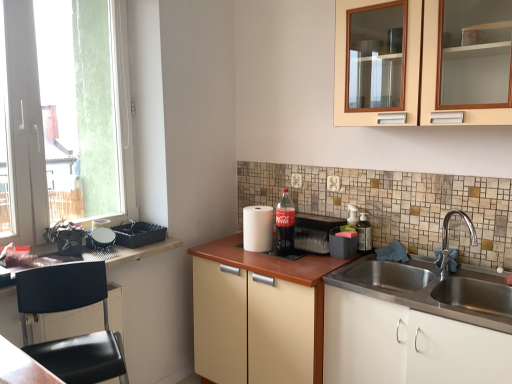
Question: Can you confirm if black plastic chair at lower left, which is the 2th cabinetry from top to bottom, is smaller than matte black tissue box at center, the fourth appliance in the left-to-right sequence?

Choices:
 (A) no
 (B) yes

Answer: (A)

Question: Would you say black plastic chair at lower left, which is the 2th cabinetry from top to bottom, is outside matte black tissue box at center, which is counted as the 1th appliance, starting from the right?

Choices:
 (A) no
 (B) yes

Answer: (B)

Question: Is black plastic chair at lower left, the third cabinetry in the bottom-to-top sequence, directly adjacent to matte black tissue box at center, which is counted as the 1th appliance, starting from the right?

Choices:
 (A) yes
 (B) no

Answer: (B)

Question: Can you confirm if black plastic chair at lower left, which is the 2th cabinetry from top to bottom, is taller than matte black tissue box at center, the fourth appliance in the left-to-right sequence?

Choices:
 (A) yes
 (B) no

Answer: (A)

Question: Does black plastic chair at lower left, the third cabinetry in the bottom-to-top sequence, have a greater width compared to matte black tissue box at center, which is counted as the 1th appliance, starting from the right?

Choices:
 (A) no
 (B) yes

Answer: (B)

Question: Is black plastic chair at lower left, which is the 2th cabinetry from top to bottom, oriented towards matte black tissue box at center, the fourth appliance in the left-to-right sequence?

Choices:
 (A) yes
 (B) no

Answer: (B)

Question: Is transparent glass window at left to the right of black plastic tray at left, arranged as the first appliance when viewed from the left, from the viewer's perspective?

Choices:
 (A) no
 (B) yes

Answer: (A)

Question: Is black plastic tray at left, arranged as the first appliance when viewed from the left, at the back of transparent glass window at left?

Choices:
 (A) no
 (B) yes

Answer: (A)

Question: Does transparent glass window at left have a smaller size compared to black plastic tray at left, positioned as the 4th appliance in right-to-left order?

Choices:
 (A) no
 (B) yes

Answer: (A)

Question: From a real-world perspective, is transparent glass window at left physically above black plastic tray at left, positioned as the 4th appliance in right-to-left order?

Choices:
 (A) no
 (B) yes

Answer: (B)

Question: From a real-world perspective, is transparent glass window at left under black plastic tray at left, arranged as the first appliance when viewed from the left?

Choices:
 (A) no
 (B) yes

Answer: (A)

Question: Is transparent glass window at left positioned before black plastic tray at left, positioned as the 4th appliance in right-to-left order?

Choices:
 (A) yes
 (B) no

Answer: (A)

Question: From a real-world perspective, is wooden countertop at left on beige wood cabinet at upper center, acting as the fourth cabinetry starting from the bottom?

Choices:
 (A) no
 (B) yes

Answer: (A)